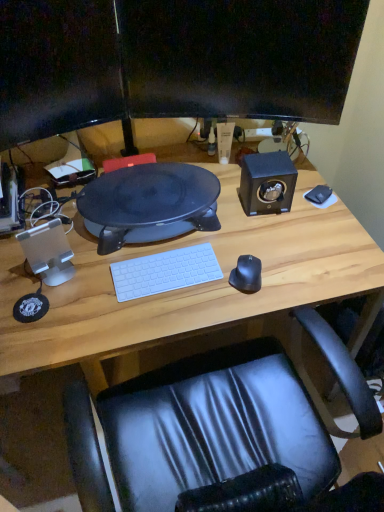
Question: Which direction should I rotate to look at matte black monitor at upper center, the 1th computer monitor positioned from the left, — up or down?

Choices:
 (A) down
 (B) up

Answer: (B)

Question: Considering the relative sizes of matte black monitor at upper center, the 1th computer monitor positioned from the left, and transparent plastic speaker at left, which is counted as the first speaker, starting from the front, in the image provided, is matte black monitor at upper center, the 1th computer monitor positioned from the left, shorter than transparent plastic speaker at left, which is counted as the first speaker, starting from the front,?

Choices:
 (A) yes
 (B) no

Answer: (B)

Question: Does matte black monitor at upper center, which is counted as the 2th computer monitor, starting from the right, have a larger size compared to transparent plastic speaker at left, which is counted as the first speaker, starting from the front?

Choices:
 (A) no
 (B) yes

Answer: (B)

Question: Can you confirm if matte black monitor at upper center, which is counted as the 2th computer monitor, starting from the right, is thinner than transparent plastic speaker at left, acting as the 2th speaker starting from the right?

Choices:
 (A) no
 (B) yes

Answer: (B)

Question: Does matte black monitor at upper center, the 1th computer monitor positioned from the left, come behind transparent plastic speaker at left, acting as the 1th speaker starting from the left?

Choices:
 (A) yes
 (B) no

Answer: (B)

Question: Is matte black monitor at upper center, the 1th computer monitor positioned from the left, touching transparent plastic speaker at left, which appears as the second speaker when viewed from the top?

Choices:
 (A) yes
 (B) no

Answer: (B)

Question: Can you confirm if matte black monitor at upper center, the 1th computer monitor positioned from the left, is taller than transparent plastic speaker at left, which is counted as the first speaker, starting from the front?

Choices:
 (A) no
 (B) yes

Answer: (B)

Question: Can you confirm if matte black monitor at upper center, the 1th computer monitor positioned from the left, is shorter than wooden desk at center?

Choices:
 (A) yes
 (B) no

Answer: (A)

Question: Is matte black monitor at upper center, the 1th computer monitor positioned from the left, directly adjacent to wooden desk at center?

Choices:
 (A) yes
 (B) no

Answer: (B)

Question: From the image's perspective, is matte black monitor at upper center, which is counted as the 2th computer monitor, starting from the right, under wooden desk at center?

Choices:
 (A) yes
 (B) no

Answer: (B)

Question: Is matte black monitor at upper center, the 1th computer monitor positioned from the left, outside of wooden desk at center?

Choices:
 (A) yes
 (B) no

Answer: (A)

Question: From a real-world perspective, is matte black monitor at upper center, the 1th computer monitor positioned from the left, over wooden desk at center?

Choices:
 (A) no
 (B) yes

Answer: (B)

Question: Is matte black monitor at upper center, which is counted as the 2th computer monitor, starting from the right, not close to wooden desk at center?

Choices:
 (A) yes
 (B) no

Answer: (B)

Question: From a real-world perspective, is transparent plastic speaker at left, which is the first speaker from bottom to top, located beneath black matte speaker at upper right, which is the 2th speaker from bottom to top?

Choices:
 (A) no
 (B) yes

Answer: (B)